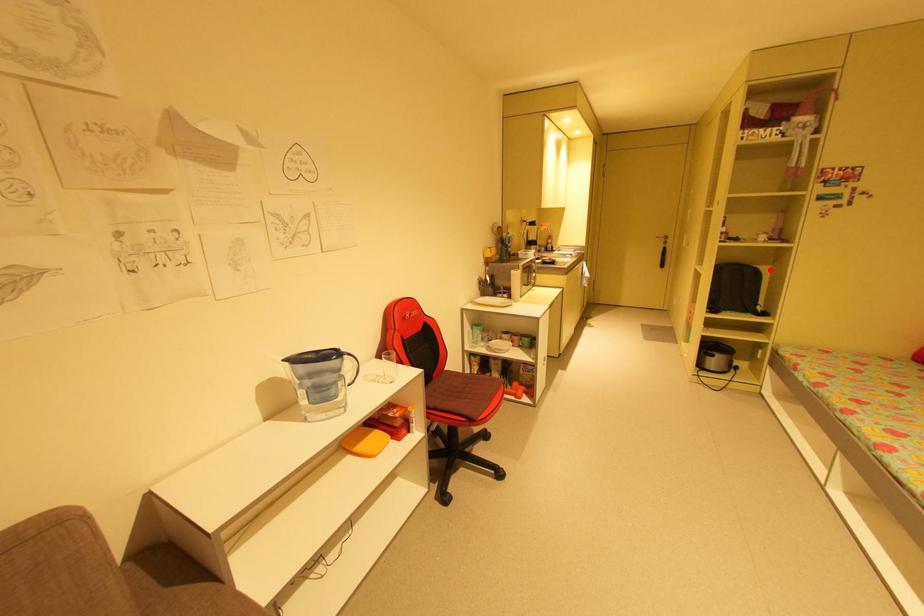
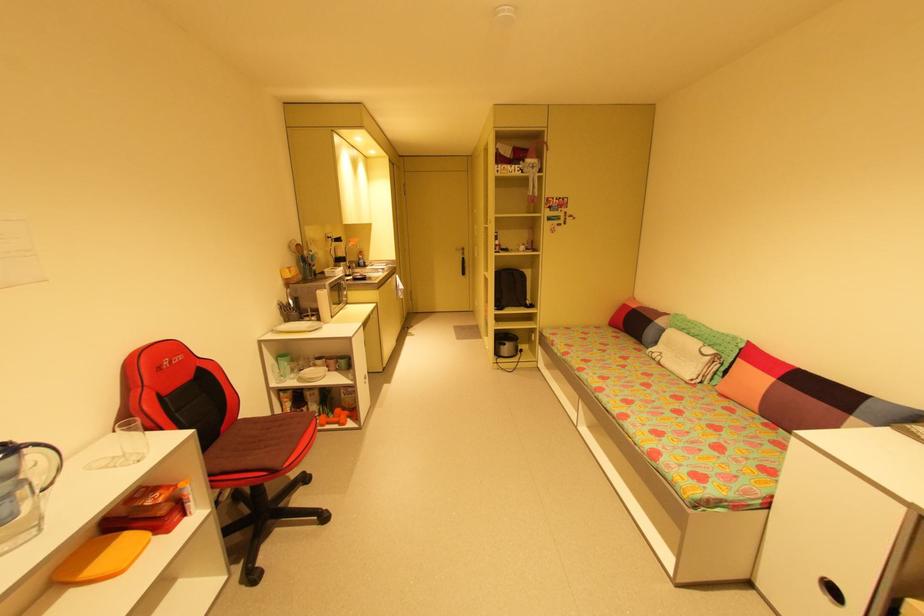
Find the pixel in the second image that matches the highlighted location in the first image.

(532, 273)